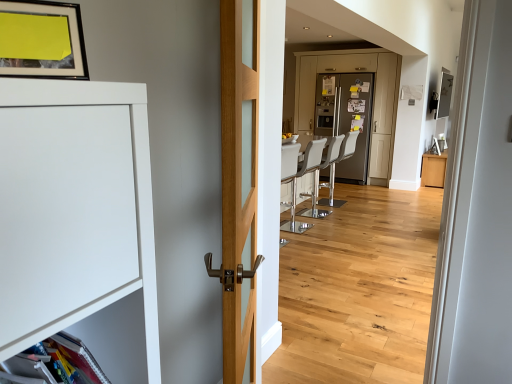
Measure the distance between point (426, 24) and camera.

A distance of 5.38 meters exists between point (426, 24) and camera.

The height and width of the screenshot is (384, 512). In order to click on white leather barstool at center, which is the second armchair in front-to-back order in this screenshot , I will do `click(314, 201)`.

Describe the element at coordinates (41, 40) in the screenshot. Image resolution: width=512 pixels, height=384 pixels. I see `matte black picture frame at upper left` at that location.

The image size is (512, 384). Identify the location of white leather barstool at center, acting as the 3th armchair starting from the back. click(x=301, y=176).

The image size is (512, 384). What are the coordinates of `satin silver refrigerator at center, arranged as the second screen door when viewed from the right` in the screenshot? It's located at (374, 97).

Which is more to the left, satin silver refrigerator at center, positioned as the first screen door in left-to-right order, or wooden floor at center?

From the viewer's perspective, wooden floor at center appears more on the left side.

Considering the relative positions of satin silver refrigerator at center, positioned as the first screen door in left-to-right order, and wooden floor at center in the image provided, is satin silver refrigerator at center, positioned as the first screen door in left-to-right order, in front of wooden floor at center?

No, it is not.

Are satin silver refrigerator at center, positioned as the first screen door in left-to-right order, and wooden floor at center beside each other?

No, satin silver refrigerator at center, positioned as the first screen door in left-to-right order, is not making contact with wooden floor at center.

Considering the sizes of satin silver refrigerator at center, arranged as the second screen door when viewed from the right, and wooden floor at center in the image, is satin silver refrigerator at center, arranged as the second screen door when viewed from the right, bigger or smaller than wooden floor at center?

Considering their sizes, satin silver refrigerator at center, arranged as the second screen door when viewed from the right, takes up more space than wooden floor at center.

From the image's perspective, between matte black picture frame at upper left and white leather barstool at center, which appears as the 1th armchair when viewed from the front, who is located below?

white leather barstool at center, which appears as the 1th armchair when viewed from the front.

Is matte black picture frame at upper left oriented towards white leather barstool at center, acting as the 3th armchair starting from the back?

No.

What's the angular difference between matte black picture frame at upper left and white leather barstool at center, which appears as the 1th armchair when viewed from the front,'s facing directions?

There is a 152-degree angle between the facing directions of matte black picture frame at upper left and white leather barstool at center, which appears as the 1th armchair when viewed from the front.

Which object is thinner, matte black picture frame at upper left or white leather barstool at center, acting as the 3th armchair starting from the back?

matte black picture frame at upper left is thinner.

In the scene shown: Considering the relative sizes of white leather barstool at center, which is the second armchair in front-to-back order, and matte black picture frame at upper left in the image provided, is white leather barstool at center, which is the second armchair in front-to-back order, bigger than matte black picture frame at upper left?

Yes, white leather barstool at center, which is the second armchair in front-to-back order, is bigger than matte black picture frame at upper left.

Can you confirm if white leather barstool at center, placed as the second armchair when sorted from back to front, is positioned to the left of matte black picture frame at upper left?

In fact, white leather barstool at center, placed as the second armchair when sorted from back to front, is to the right of matte black picture frame at upper left.

I want to click on picture frame that appears in front of the white leather barstool at center, which is the second armchair in front-to-back order, so click(x=41, y=40).

Which object is wider, white leather barstool at center, which is the second armchair in front-to-back order, or matte black picture frame at upper left?

white leather barstool at center, which is the second armchair in front-to-back order.

Between light oak wood door at center and wooden floor at center, which one has smaller width?

wooden floor at center.

From a real-world perspective, is light oak wood door at center above or below wooden floor at center?

Clearly, from a real-world perspective, light oak wood door at center is above wooden floor at center.

Is light oak wood door at center closer to camera compared to wooden floor at center?

That is True.

In terms of size, does light oak wood door at center appear bigger or smaller than wooden floor at center?

In the image, light oak wood door at center appears to be smaller than wooden floor at center.

Between wooden floor at center and matte black picture frame at upper left, which one has smaller width?

matte black picture frame at upper left is thinner.

From the image's perspective, is wooden floor at center under matte black picture frame at upper left?

Indeed, from the image's perspective, wooden floor at center is shown beneath matte black picture frame at upper left.

Can you see wooden floor at center touching matte black picture frame at upper left?

wooden floor at center and matte black picture frame at upper left are not in contact.

Looking at this image, would you say white leather barstool at center, placed as the second armchair when sorted from back to front, is outside white leather barstool at center, the 3th armchair in the front-to-back sequence?

Yes.

Is the surface of white leather barstool at center, which is the second armchair in front-to-back order, in direct contact with white leather barstool at center, acting as the 1th armchair starting from the back?

No, white leather barstool at center, which is the second armchair in front-to-back order, is not next to white leather barstool at center, acting as the 1th armchair starting from the back.

From the image's perspective, would you say white leather barstool at center, which is the second armchair in front-to-back order, is positioned over white leather barstool at center, the 3th armchair in the front-to-back sequence?

No, from the image's perspective, white leather barstool at center, which is the second armchair in front-to-back order, is not over white leather barstool at center, the 3th armchair in the front-to-back sequence.

Considering the relative sizes of white leather barstool at center, which is the second armchair in front-to-back order, and white leather barstool at center, acting as the 1th armchair starting from the back, in the image provided, is white leather barstool at center, which is the second armchair in front-to-back order, smaller than white leather barstool at center, acting as the 1th armchair starting from the back,?

No, white leather barstool at center, which is the second armchair in front-to-back order, is not smaller than white leather barstool at center, acting as the 1th armchair starting from the back.

Looking at this image, considering the relative sizes of silver metallic refrigerator at center, marked as the first screen door in a right-to-left arrangement, and white leather barstool at center, which appears as the 1th armchair when viewed from the front, in the image provided, is silver metallic refrigerator at center, marked as the first screen door in a right-to-left arrangement, shorter than white leather barstool at center, which appears as the 1th armchair when viewed from the front,?

No.

From the image's perspective, is silver metallic refrigerator at center, marked as the first screen door in a right-to-left arrangement, located above white leather barstool at center, acting as the 3th armchair starting from the back?

Yes, from the image's perspective, silver metallic refrigerator at center, marked as the first screen door in a right-to-left arrangement, is over white leather barstool at center, acting as the 3th armchair starting from the back.

Is silver metallic refrigerator at center, marked as the first screen door in a right-to-left arrangement, oriented towards white leather barstool at center, which appears as the 1th armchair when viewed from the front?

Yes, silver metallic refrigerator at center, marked as the first screen door in a right-to-left arrangement, is facing white leather barstool at center, which appears as the 1th armchair when viewed from the front.

Can you see silver metallic refrigerator at center, marked as the first screen door in a right-to-left arrangement, touching white leather barstool at center, which appears as the 1th armchair when viewed from the front?

No, silver metallic refrigerator at center, marked as the first screen door in a right-to-left arrangement, is not in contact with white leather barstool at center, which appears as the 1th armchair when viewed from the front.

Identify the location of the 1st screen door to the right of the wooden floor at center, counting from the anchor's position. (374, 97).

Locate an element on the screen. picture frame that is above the white leather barstool at center, acting as the 3th armchair starting from the back (from the image's perspective) is located at coordinates (41, 40).

When comparing their distances from light oak wood door at center, does white leather barstool at center, the 3th armchair in the front-to-back sequence, or satin silver refrigerator at center, arranged as the second screen door when viewed from the right, seem further?

Among the two, white leather barstool at center, the 3th armchair in the front-to-back sequence, is located further to light oak wood door at center.

Considering their positions, is wooden floor at center positioned further to light oak wood door at center than white leather barstool at center, acting as the 1th armchair starting from the back?

The object further to light oak wood door at center is white leather barstool at center, acting as the 1th armchair starting from the back.

When comparing their distances from white leather barstool at center, acting as the 1th armchair starting from the back, does white leather barstool at center, which is the second armchair in front-to-back order, or light oak wood door at center seem further?

light oak wood door at center.

When comparing their distances from light oak wood door at center, does white leather barstool at center, which appears as the 1th armchair when viewed from the front, or wooden floor at center seem closer?

The object closer to light oak wood door at center is white leather barstool at center, which appears as the 1th armchair when viewed from the front.

Estimate the real-world distances between objects in this image. Which object is closer to white leather barstool at center, which is the second armchair in front-to-back order, white leather barstool at center, acting as the 1th armchair starting from the back, or silver metallic refrigerator at center, arranged as the second screen door when viewed from the left?

white leather barstool at center, acting as the 1th armchair starting from the back, lies closer to white leather barstool at center, which is the second armchair in front-to-back order, than the other object.

Considering their positions, is light oak wood door at center positioned further to silver metallic refrigerator at center, arranged as the second screen door when viewed from the left, than white leather barstool at center, which is the second armchair in front-to-back order?

Among the two, light oak wood door at center is located further to silver metallic refrigerator at center, arranged as the second screen door when viewed from the left.

Considering their positions, is silver metallic refrigerator at center, marked as the first screen door in a right-to-left arrangement, positioned closer to light oak wood door at center than satin silver refrigerator at center, positioned as the first screen door in left-to-right order?

The object closer to light oak wood door at center is satin silver refrigerator at center, positioned as the first screen door in left-to-right order.

Estimate the real-world distances between objects in this image. Which object is further from white leather barstool at center, placed as the second armchair when sorted from back to front, white leather barstool at center, acting as the 1th armchair starting from the back, or wooden floor at center?

white leather barstool at center, acting as the 1th armchair starting from the back, lies further to white leather barstool at center, placed as the second armchair when sorted from back to front, than the other object.

Find the location of `corridor between light oak wood door at center and satin silver refrigerator at center, positioned as the first screen door in left-to-right order, along the z-axis`. corridor between light oak wood door at center and satin silver refrigerator at center, positioned as the first screen door in left-to-right order, along the z-axis is located at coordinates (402, 63).

Image resolution: width=512 pixels, height=384 pixels. Identify the location of corridor between matte black picture frame at upper left and white leather barstool at center, which appears as the 1th armchair when viewed from the front, along the z-axis. pyautogui.click(x=402, y=63).

The image size is (512, 384). I want to click on screen door between white leather barstool at center, which appears as the 1th armchair when viewed from the front, and silver metallic refrigerator at center, arranged as the second screen door when viewed from the left, along the z-axis, so click(x=374, y=97).

Find the location of a particular element. The height and width of the screenshot is (384, 512). corridor positioned between light oak wood door at center and white leather barstool at center, which is the second armchair in front-to-back order, from near to far is located at coordinates (402, 63).